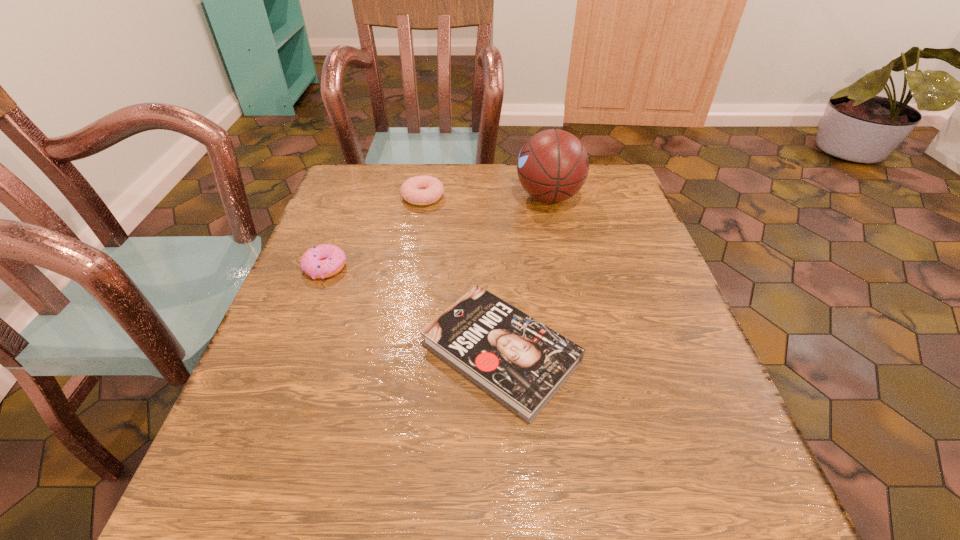
You are a GUI agent. You are given a task and a screenshot of the screen. Output one action in this format:
    pyautogui.click(x=<x>, y=<y>)
    Task: Click on the basketball
    Image resolution: width=960 pixels, height=540 pixels.
    Given the screenshot: What is the action you would take?
    pyautogui.click(x=553, y=165)

Locate an element on the screen. This screenshot has width=960, height=540. the farther doughnut is located at coordinates (419, 190).

Locate an element on the screen. the left doughnut is located at coordinates (322, 261).

You are a GUI agent. You are given a task and a screenshot of the screen. Output one action in this format:
    pyautogui.click(x=<x>, y=<y>)
    Task: Click on the leftmost object
    The height and width of the screenshot is (540, 960).
    Given the screenshot: What is the action you would take?
    pyautogui.click(x=322, y=261)

I want to click on the nearest object, so click(522, 363).

Find the location of `the shortest object`. the shortest object is located at coordinates tap(522, 363).

Identify the location of vacant region located 0.220m on the left of the basketball. (430, 197).

Identify the location of free location located on the right of the farther doughnut. This screenshot has width=960, height=540. (558, 197).

Find the location of a particular element. free space located on the front of the leftmost object is located at coordinates (283, 376).

Locate an element on the screen. vacant space situated 0.190m on the left of the shortest object is located at coordinates (311, 353).